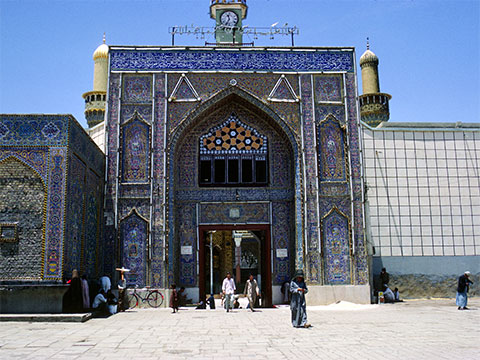
Find the location of a particular element. The width and height of the screenshot is (480, 360). hour hand on clock is located at coordinates (227, 14).